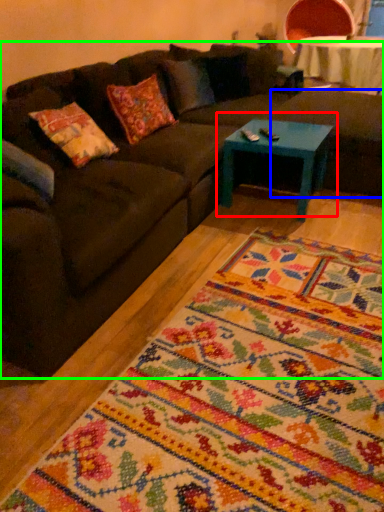
Question: Which object is positioned farthest from coffee table (highlighted by a red box)? Select from footrest (highlighted by a blue box) and studio couch (highlighted by a green box).

Choices:
 (A) footrest
 (B) studio couch

Answer: (B)